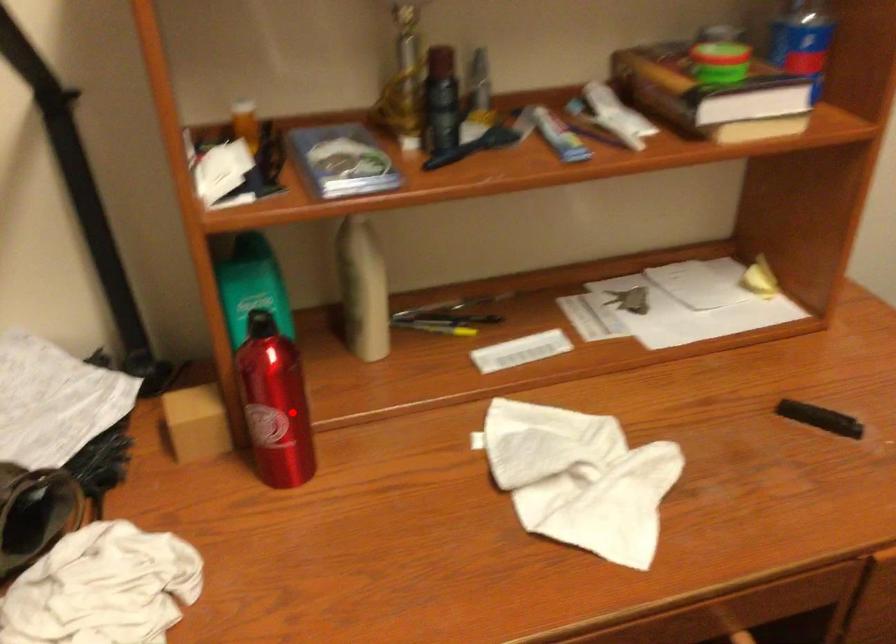
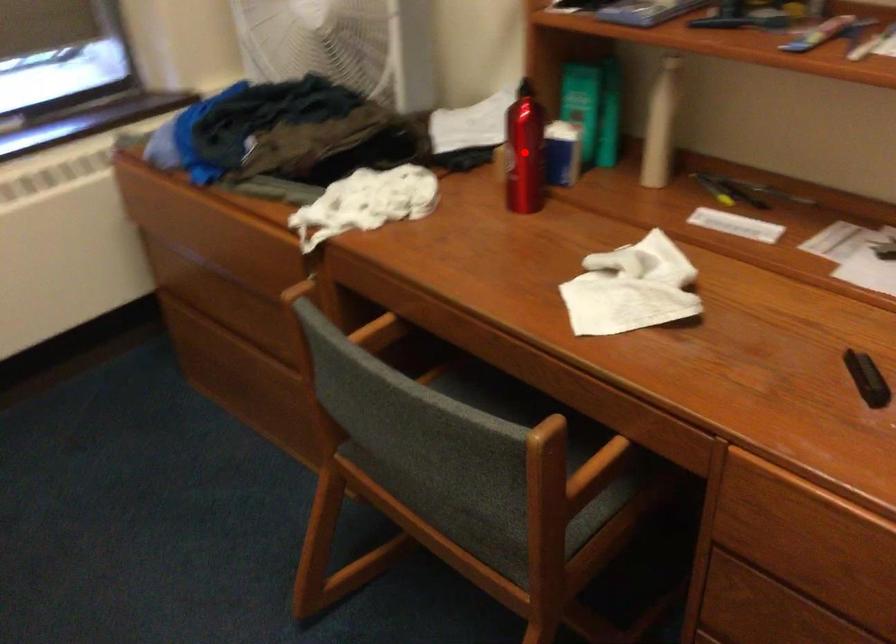
I am providing you with two images of the same scene from different viewpoints. A red point is marked on the first image and another point is marked on the second image. Is the red point in image1 aligned with the point shown in image2?

Yes